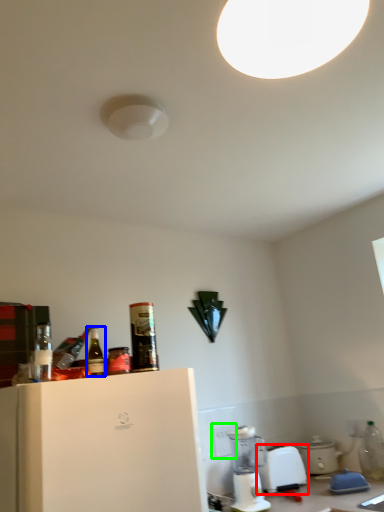
Question: Which object is the closest to the kitchen appliance (highlighted by a red box)? Choose among these: bottle (highlighted by a blue box) or electric outlet (highlighted by a green box).

Choices:
 (A) bottle
 (B) electric outlet

Answer: (B)